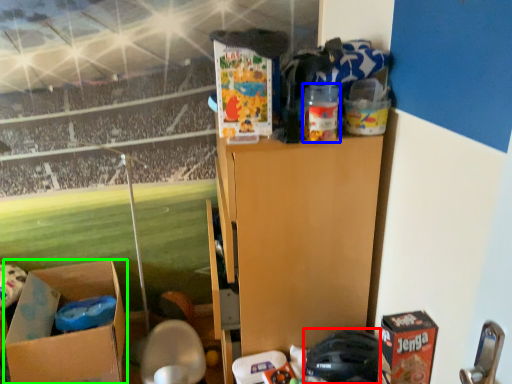
Question: Estimate the real-world distances between objects in this image. Which object is closer to toy (highlighted by a red box), toy (highlighted by a blue box) or box (highlighted by a green box)?

Choices:
 (A) toy
 (B) box

Answer: (A)